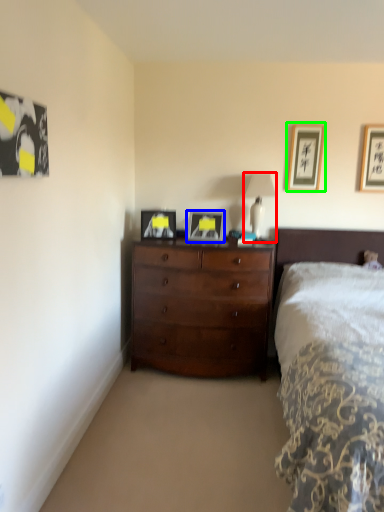
Question: Which object is the farthest from table lamp (highlighted by a red box)? Choose among these: picture frame (highlighted by a blue box) or picture frame (highlighted by a green box).

Choices:
 (A) picture frame
 (B) picture frame

Answer: (A)